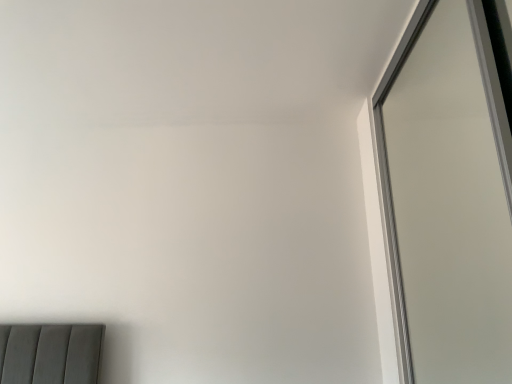
What do you see at coordinates (449, 191) in the screenshot? I see `clear glass window at right` at bounding box center [449, 191].

Identify the location of clear glass window at right. Image resolution: width=512 pixels, height=384 pixels. (449, 191).

The image size is (512, 384). Identify the location of clear glass window at right. (449, 191).